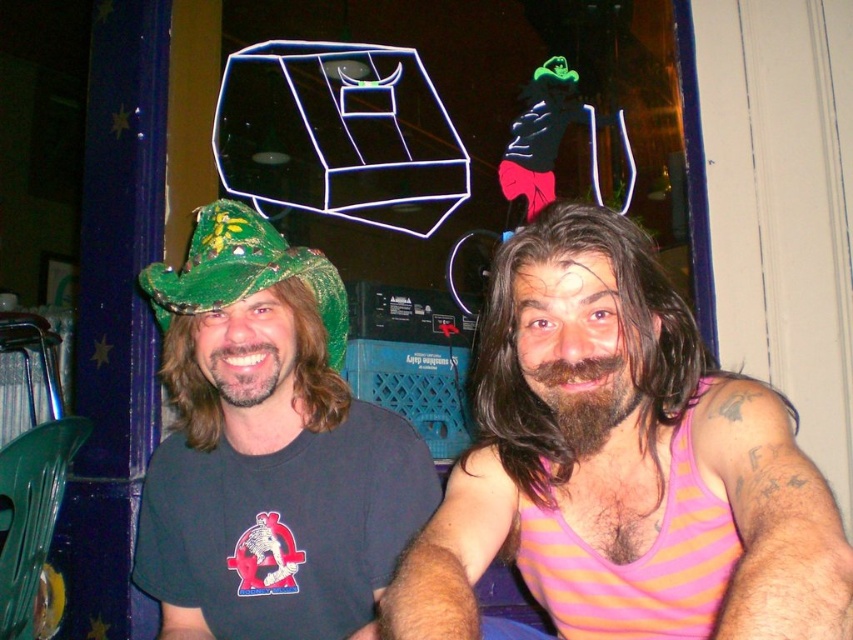
In the scene shown: Which is more to the left, green sequined hat at upper left or green glittery hat at left?

From the viewer's perspective, green glittery hat at left appears more on the left side.

What do you see at coordinates (268, 449) in the screenshot? Image resolution: width=853 pixels, height=640 pixels. I see `green sequined hat at upper left` at bounding box center [268, 449].

The image size is (853, 640). Identify the location of green sequined hat at upper left. (268, 449).

Which is in front, point (480, 324) or point (141, 278)?

Point (480, 324) is in front.

From the picture: Can you confirm if pink striped tank top at center is bigger than green glittery hat at left?

Indeed, pink striped tank top at center has a larger size compared to green glittery hat at left.

Between point (734, 604) and point (210, 204), which one is positioned behind?

Point (210, 204)

Identify the location of pink striped tank top at center. This screenshot has width=853, height=640. (618, 445).

Can you confirm if pink striped tank top at center is positioned to the right of green sequined hat at upper left?

Correct, you'll find pink striped tank top at center to the right of green sequined hat at upper left.

Between pink striped tank top at center and green sequined hat at upper left, which one is positioned lower?

pink striped tank top at center is below.

Is point (815, 484) less distant than point (373, 444)?

That is True.

Where is `pink striped tank top at center`? pink striped tank top at center is located at coordinates (618, 445).